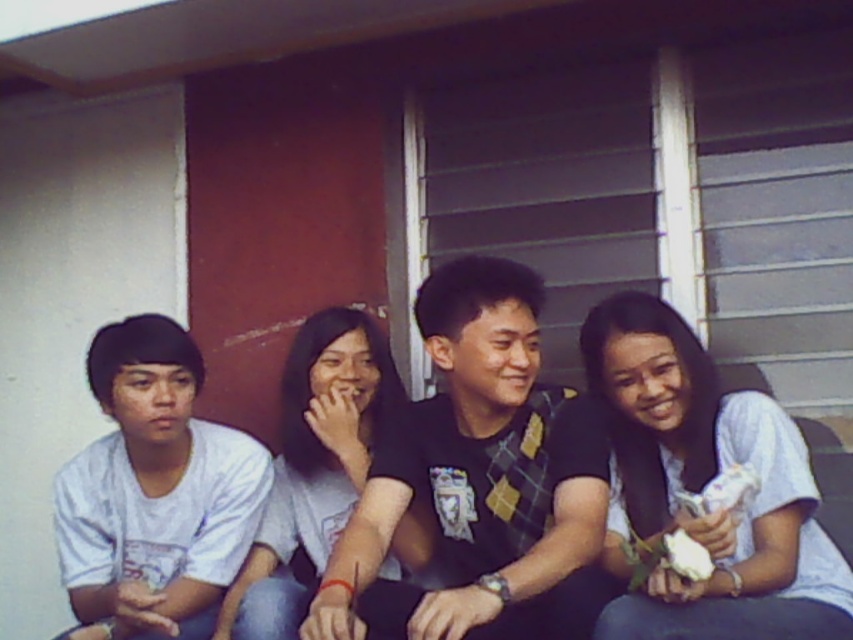
Between black matte shirt at center and white cotton shirt at right, which one is positioned higher?

black matte shirt at center

Is point (331, 554) behind point (625, 413)?

Yes, it is.

Locate an element on the screen. This screenshot has width=853, height=640. black matte shirt at center is located at coordinates (479, 461).

Is white cotton shirt at right shorter than light blue t-shirt at center?

Correct, white cotton shirt at right is not as tall as light blue t-shirt at center.

The width and height of the screenshot is (853, 640). I want to click on white cotton shirt at right, so click(x=704, y=486).

This screenshot has width=853, height=640. Describe the element at coordinates (479, 461) in the screenshot. I see `black matte shirt at center` at that location.

Does point (583, 413) come farther from viewer compared to point (300, 400)?

No, it is not.

What are the coordinates of `black matte shirt at center` in the screenshot? It's located at (479, 461).